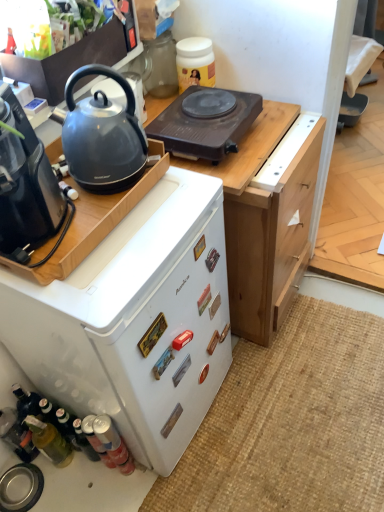
Question: Is brown plastic electric hot plate at upper center to the right of metallic silver sink at lower left, the 3th kitchen appliance in the top-to-bottom sequence, from the viewer's perspective?

Choices:
 (A) no
 (B) yes

Answer: (B)

Question: Considering the relative sizes of brown plastic electric hot plate at upper center and metallic silver sink at lower left, the 3th kitchen appliance in the top-to-bottom sequence, in the image provided, is brown plastic electric hot plate at upper center smaller than metallic silver sink at lower left, the 3th kitchen appliance in the top-to-bottom sequence,?

Choices:
 (A) no
 (B) yes

Answer: (A)

Question: Does brown plastic electric hot plate at upper center have a larger size compared to metallic silver sink at lower left, the 3th kitchen appliance in the top-to-bottom sequence?

Choices:
 (A) no
 (B) yes

Answer: (B)

Question: Does brown plastic electric hot plate at upper center come behind metallic silver sink at lower left, the 3th kitchen appliance in the top-to-bottom sequence?

Choices:
 (A) no
 (B) yes

Answer: (A)

Question: Considering the relative sizes of brown plastic electric hot plate at upper center and metallic silver sink at lower left, the 3th kitchen appliance in the top-to-bottom sequence, in the image provided, is brown plastic electric hot plate at upper center shorter than metallic silver sink at lower left, the 3th kitchen appliance in the top-to-bottom sequence,?

Choices:
 (A) yes
 (B) no

Answer: (B)

Question: Looking at the image, does burlap mat at lower right seem bigger or smaller compared to satin black kettle at upper left, which is the 3th kitchen appliance in bottom-to-top order?

Choices:
 (A) small
 (B) big

Answer: (B)

Question: Is burlap mat at lower right inside the boundaries of satin black kettle at upper left, which is the 3th kitchen appliance in bottom-to-top order, or outside?

Choices:
 (A) outside
 (B) inside

Answer: (A)

Question: From a real-world perspective, is burlap mat at lower right physically located above or below satin black kettle at upper left, which appears as the first kitchen appliance when viewed from the top?

Choices:
 (A) below
 (B) above

Answer: (A)

Question: Looking at their shapes, would you say burlap mat at lower right is wider or thinner than satin black kettle at upper left, which is the 3th kitchen appliance in bottom-to-top order?

Choices:
 (A) thin
 (B) wide

Answer: (B)

Question: In terms of width, does satin black kettle at upper left, which appears as the first kitchen appliance when viewed from the top, look wider or thinner when compared to metallic silver sink at lower left, the 3th kitchen appliance in the top-to-bottom sequence?

Choices:
 (A) wide
 (B) thin

Answer: (A)

Question: Is point (107, 27) closer or farther from the camera than point (16, 472)?

Choices:
 (A) farther
 (B) closer

Answer: (B)

Question: Based on their positions, is satin black kettle at upper left, which is the 3th kitchen appliance in bottom-to-top order, located to the left or right of metallic silver sink at lower left, the 1th kitchen appliance ordered from the bottom?

Choices:
 (A) right
 (B) left

Answer: (A)

Question: Considering the positions of satin black kettle at upper left, which appears as the first kitchen appliance when viewed from the top, and metallic silver sink at lower left, the 3th kitchen appliance in the top-to-bottom sequence, in the image, is satin black kettle at upper left, which appears as the first kitchen appliance when viewed from the top, taller or shorter than metallic silver sink at lower left, the 3th kitchen appliance in the top-to-bottom sequence,?

Choices:
 (A) tall
 (B) short

Answer: (A)

Question: In terms of width, does black plastic coffee maker at left look wider or thinner when compared to metallic silver sink at lower left, the 3th kitchen appliance in the top-to-bottom sequence?

Choices:
 (A) thin
 (B) wide

Answer: (B)

Question: From a real-world perspective, is black plastic coffee maker at left above or below metallic silver sink at lower left, the 3th kitchen appliance in the top-to-bottom sequence?

Choices:
 (A) below
 (B) above

Answer: (B)